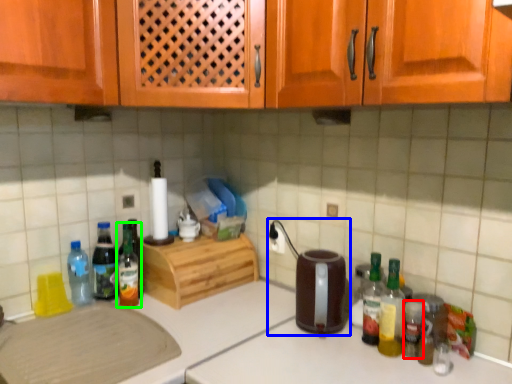
Question: Which is farther away from bottle (highlighted by a red box)? appliance (highlighted by a blue box) or bottle (highlighted by a green box)?

Choices:
 (A) appliance
 (B) bottle

Answer: (B)